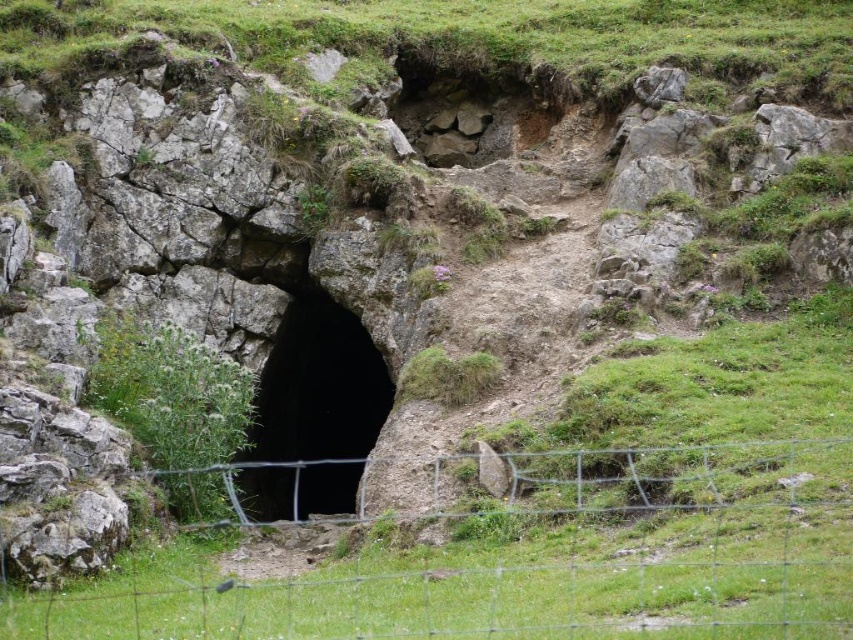
Who is taller, wire mesh fence at center or black rock hole at center?

Standing taller between the two is black rock hole at center.

Who is more distant from viewer, (627,532) or (300,374)?

The point (300,374) is more distant.

Measure the distance between wire mesh fence at center and camera.

A distance of 74.84 feet exists between wire mesh fence at center and camera.

The height and width of the screenshot is (640, 853). I want to click on wire mesh fence at center, so click(515, 557).

Based on the photo, does wire mesh fence at center have a larger size compared to green grassy at upper center?

Incorrect, wire mesh fence at center is not larger than green grassy at upper center.

Which is more to the left, wire mesh fence at center or green grassy at upper center?

wire mesh fence at center

Where is `wire mesh fence at center`? Image resolution: width=853 pixels, height=640 pixels. wire mesh fence at center is located at coordinates (515, 557).

Find the location of a particular element. This screenshot has width=853, height=640. wire mesh fence at center is located at coordinates (515, 557).

Does green grassy at upper center appear under black rock hole at center?

No.

Is green grassy at upper center above black rock hole at center?

Correct, green grassy at upper center is located above black rock hole at center.

At what (x,y) coordinates should I click in order to perform the action: click on green grassy at upper center. Please return your answer as a coordinate pair (x, y). The image size is (853, 640). Looking at the image, I should click on (480, 36).